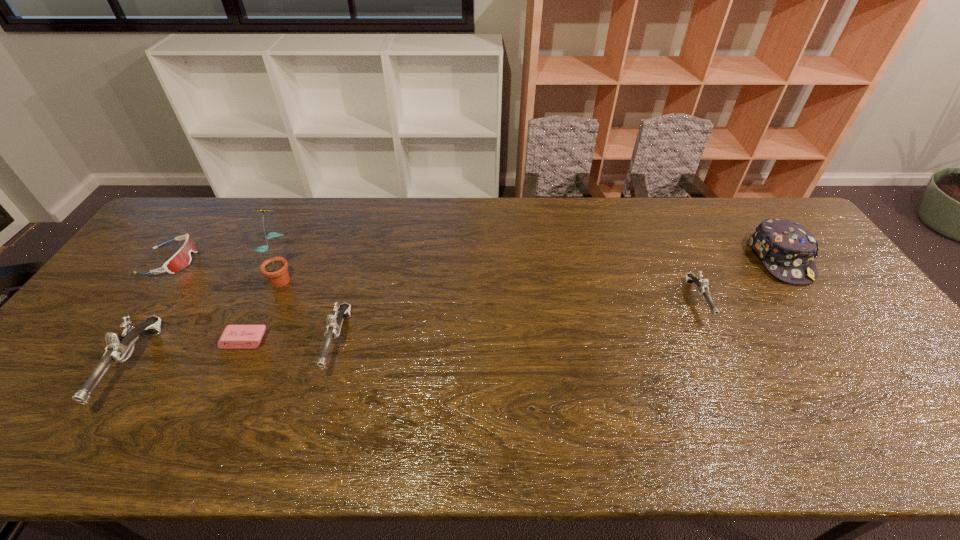
Identify the location of vacant space located aimed along the barrel of the shortest gun. This screenshot has height=540, width=960. (727, 363).

In order to click on free space located on the front-facing side of the rightmost object in this screenshot , I will do `click(830, 330)`.

Where is `vacant area located on the flower of the tallest object`? The width and height of the screenshot is (960, 540). vacant area located on the flower of the tallest object is located at coordinates (251, 347).

At what (x,y) coordinates should I click in order to perform the action: click on free space located 0.120m on the front-facing side of the sixth tallest object. Please return your answer as a coordinate pair (x, y). Looking at the image, I should click on (236, 261).

At what (x,y) coordinates should I click in order to perform the action: click on vacant position located on the back of the shortest object. Please return your answer as a coordinate pair (x, y). This screenshot has height=540, width=960. Looking at the image, I should click on (278, 267).

I want to click on object at the far edge, so click(x=787, y=250).

You are a GUI agent. You are given a task and a screenshot of the screen. Output one action in this format:
    pyautogui.click(x=<x>, y=<y>)
    Task: Click on the object present at the left edge
    The width and height of the screenshot is (960, 540).
    Given the screenshot: What is the action you would take?
    pyautogui.click(x=182, y=258)

The image size is (960, 540). Identify the location of object that is at the right edge. (787, 250).

Where is `object at the far right corner`? This screenshot has height=540, width=960. object at the far right corner is located at coordinates (787, 250).

Locate an element on the screen. free space at the far edge is located at coordinates (324, 208).